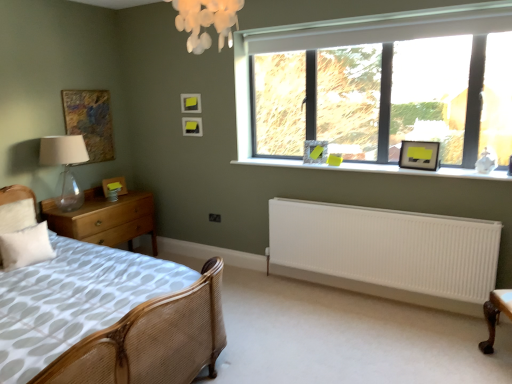
Question: From the image's perspective, is matte black picture frame at upper center, which is the third picture frame from left to right, located beneath transparent glass table lamp at left?

Choices:
 (A) no
 (B) yes

Answer: (A)

Question: Is transparent glass table lamp at left located within matte black picture frame at upper center, which ranks as the 4th picture frame in right-to-left order?

Choices:
 (A) no
 (B) yes

Answer: (A)

Question: Is matte black picture frame at upper center, which is the third picture frame from left to right, taller than transparent glass table lamp at left?

Choices:
 (A) yes
 (B) no

Answer: (B)

Question: Can you confirm if matte black picture frame at upper center, which is the third picture frame from left to right, is shorter than transparent glass table lamp at left?

Choices:
 (A) yes
 (B) no

Answer: (A)

Question: From a real-world perspective, is matte black picture frame at upper center, which is the third picture frame from left to right, located beneath transparent glass table lamp at left?

Choices:
 (A) yes
 (B) no

Answer: (B)

Question: Can you confirm if matte black picture frame at upper center, which ranks as the 4th picture frame in right-to-left order, is smaller than transparent glass table lamp at left?

Choices:
 (A) yes
 (B) no

Answer: (A)

Question: Is wooden chest of drawers at left in front of clear glass window at upper right?

Choices:
 (A) yes
 (B) no

Answer: (B)

Question: Is wooden chest of drawers at left turned away from clear glass window at upper right?

Choices:
 (A) no
 (B) yes

Answer: (A)

Question: From the image's perspective, is wooden chest of drawers at left on clear glass window at upper right?

Choices:
 (A) no
 (B) yes

Answer: (A)

Question: Is wooden chest of drawers at left facing towards clear glass window at upper right?

Choices:
 (A) yes
 (B) no

Answer: (B)

Question: Would you say wooden chest of drawers at left is outside clear glass window at upper right?

Choices:
 (A) no
 (B) yes

Answer: (B)

Question: From a real-world perspective, is wooden chest of drawers at left positioned over clear glass window at upper right based on gravity?

Choices:
 (A) yes
 (B) no

Answer: (B)

Question: Can you confirm if matte black picture frame at upper right, placed as the second picture frame when sorted from right to left, is smaller than matte black picture frame at upper right, positioned as the first picture frame in right-to-left order?

Choices:
 (A) yes
 (B) no

Answer: (A)